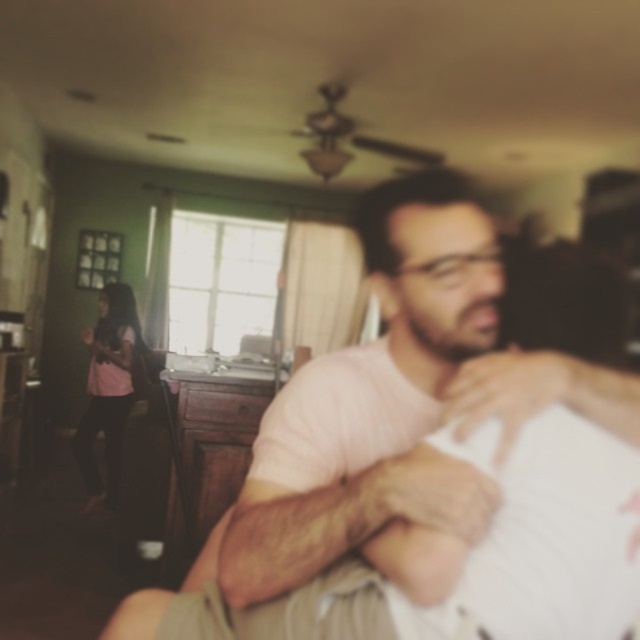
Question: Which object is farther from the camera taking this photo?

Choices:
 (A) pink cotton shirt at center
 (B) pink fabric shirt at left

Answer: (B)

Question: Where is pink cotton shirt at center located in relation to pink fabric shirt at left in the image?

Choices:
 (A) above
 (B) below

Answer: (A)

Question: Which of the following is the farthest from the observer?

Choices:
 (A) (323, 408)
 (B) (115, 397)

Answer: (B)

Question: Can you confirm if pink cotton shirt at center is positioned above pink fabric shirt at left?

Choices:
 (A) yes
 (B) no

Answer: (A)

Question: Does pink cotton shirt at center have a lesser width compared to pink fabric shirt at left?

Choices:
 (A) yes
 (B) no

Answer: (B)

Question: Among these points, which one is nearest to the camera?

Choices:
 (A) (474, 332)
 (B) (109, 413)

Answer: (A)